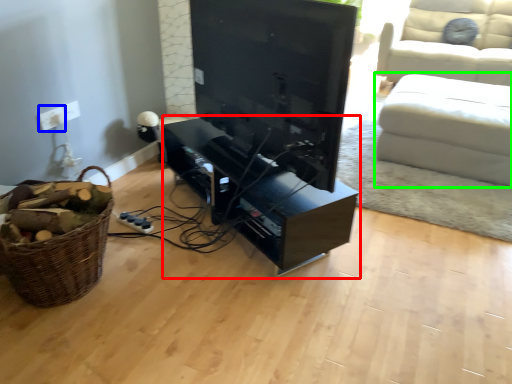
Question: Based on their relative distances, which object is nearer to entertainment center (highlighted by a red box)? Choose from electric outlet (highlighted by a blue box) and studio couch (highlighted by a green box).

Choices:
 (A) electric outlet
 (B) studio couch

Answer: (A)